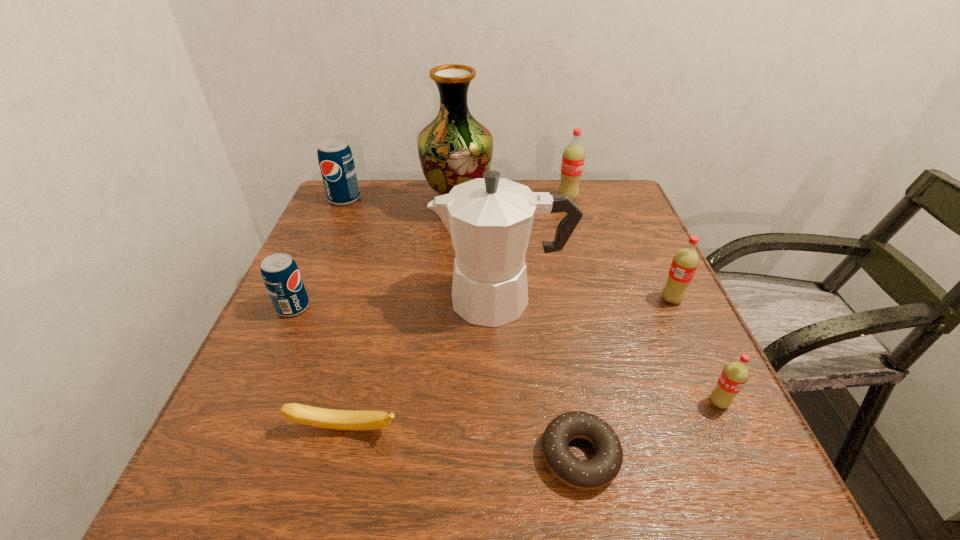
This screenshot has width=960, height=540. In order to click on yellow banana in this screenshot , I will do `click(313, 416)`.

At what (x,y) coordinates should I click in order to perform the action: click on banana. Please return your answer as a coordinate pair (x, y). Looking at the image, I should click on (313, 416).

Locate an element on the screen. the shortest object is located at coordinates (595, 473).

Locate an element on the screen. This screenshot has height=540, width=960. doughnut is located at coordinates (595, 473).

I want to click on vacant space located 0.100m on the right of the vase, so click(530, 208).

Locate an element on the screen. The height and width of the screenshot is (540, 960). free location located 0.100m at the spout of the eighth shortest object is located at coordinates (387, 299).

You are a GUI agent. You are given a task and a screenshot of the screen. Output one action in this format:
    pyautogui.click(x=<x>, y=<y>)
    Task: Click on the free point located at the spout of the eighth shortest object
    The image size is (960, 540).
    Given the screenshot: What is the action you would take?
    pyautogui.click(x=334, y=299)

What are the coordinates of `vacant region located 0.160m at the spout of the eighth shortest object` in the screenshot? It's located at (358, 299).

The image size is (960, 540). I want to click on vacant space located on the back of the farthest red soda, so click(x=563, y=179).

Image resolution: width=960 pixels, height=540 pixels. Find the location of `vacant space located on the front of the bigger blue pop`. vacant space located on the front of the bigger blue pop is located at coordinates (332, 226).